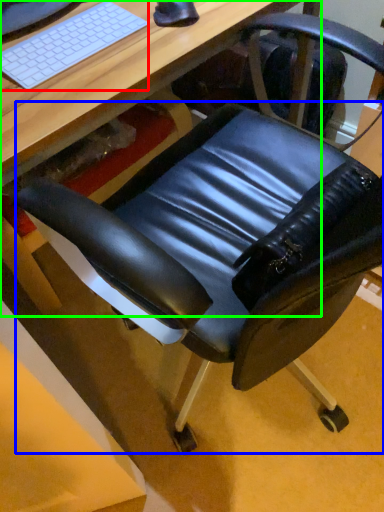
Question: Which object is the farthest from computer keyboard (highlighted by a red box)? Choose among these: swivel chair (highlighted by a blue box) or desk (highlighted by a green box).

Choices:
 (A) swivel chair
 (B) desk

Answer: (A)